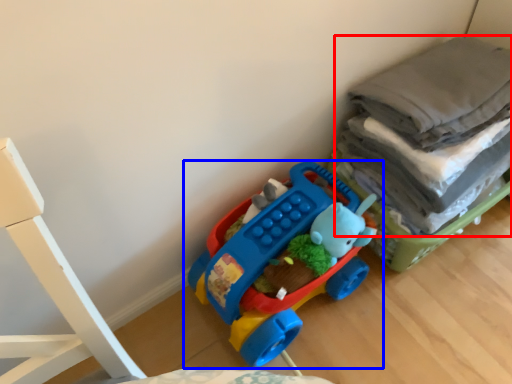
Question: Which of the following is the closest to the observer, laundry (highlighted by a red box) or toy (highlighted by a blue box)?

Choices:
 (A) laundry
 (B) toy

Answer: (A)